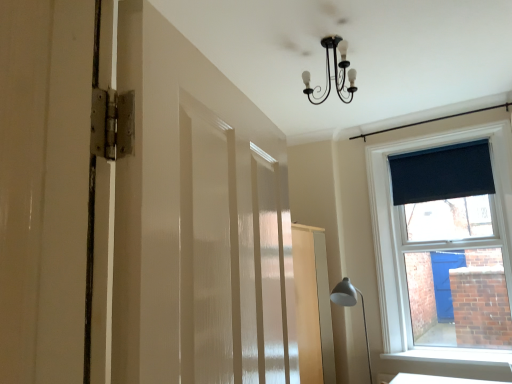
Question: Can you confirm if dark blue fabric at upper right is shorter than matte silver lamp at lower right?

Choices:
 (A) no
 (B) yes

Answer: (B)

Question: Can you confirm if dark blue fabric at upper right is wider than matte silver lamp at lower right?

Choices:
 (A) no
 (B) yes

Answer: (A)

Question: Would you say matte silver lamp at lower right is part of dark blue fabric at upper right's contents?

Choices:
 (A) no
 (B) yes

Answer: (A)

Question: From the image's perspective, is dark blue fabric at upper right under matte silver lamp at lower right?

Choices:
 (A) no
 (B) yes

Answer: (A)

Question: Are dark blue fabric at upper right and matte silver lamp at lower right making contact?

Choices:
 (A) no
 (B) yes

Answer: (A)

Question: From the image's perspective, relative to white smooth window sill at lower right, is matte silver lamp at lower right above or below?

Choices:
 (A) below
 (B) above

Answer: (B)

Question: Which is correct: matte silver lamp at lower right is inside white smooth window sill at lower right, or outside of it?

Choices:
 (A) inside
 (B) outside

Answer: (B)

Question: Is point (338, 289) closer or farther from the camera than point (401, 357)?

Choices:
 (A) farther
 (B) closer

Answer: (B)

Question: Looking at their shapes, would you say matte silver lamp at lower right is wider or thinner than white smooth window sill at lower right?

Choices:
 (A) thin
 (B) wide

Answer: (B)

Question: From the image's perspective, relative to white smooth window sill at lower right, is white textured barn door at left above or below?

Choices:
 (A) above
 (B) below

Answer: (A)

Question: Considering their positions, is white textured barn door at left located in front of or behind white smooth window sill at lower right?

Choices:
 (A) behind
 (B) front

Answer: (B)

Question: Is white textured barn door at left taller or shorter than white smooth window sill at lower right?

Choices:
 (A) short
 (B) tall

Answer: (B)

Question: In terms of size, does white textured barn door at left appear bigger or smaller than white smooth window sill at lower right?

Choices:
 (A) small
 (B) big

Answer: (B)

Question: Considering the positions of dark blue fabric at upper right and black wrought iron chandelier at upper center in the image, is dark blue fabric at upper right wider or thinner than black wrought iron chandelier at upper center?

Choices:
 (A) thin
 (B) wide

Answer: (A)

Question: In terms of size, does dark blue fabric at upper right appear bigger or smaller than black wrought iron chandelier at upper center?

Choices:
 (A) small
 (B) big

Answer: (A)